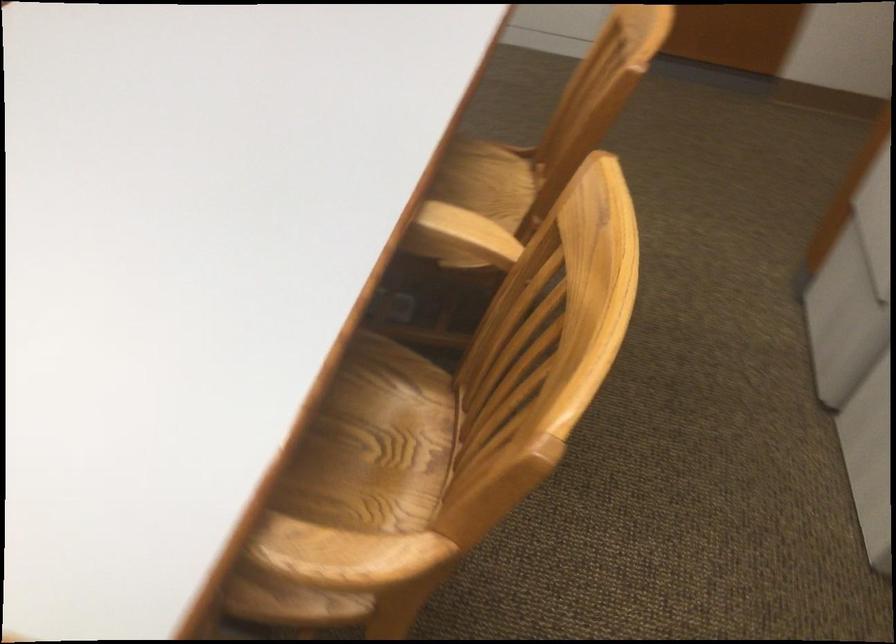
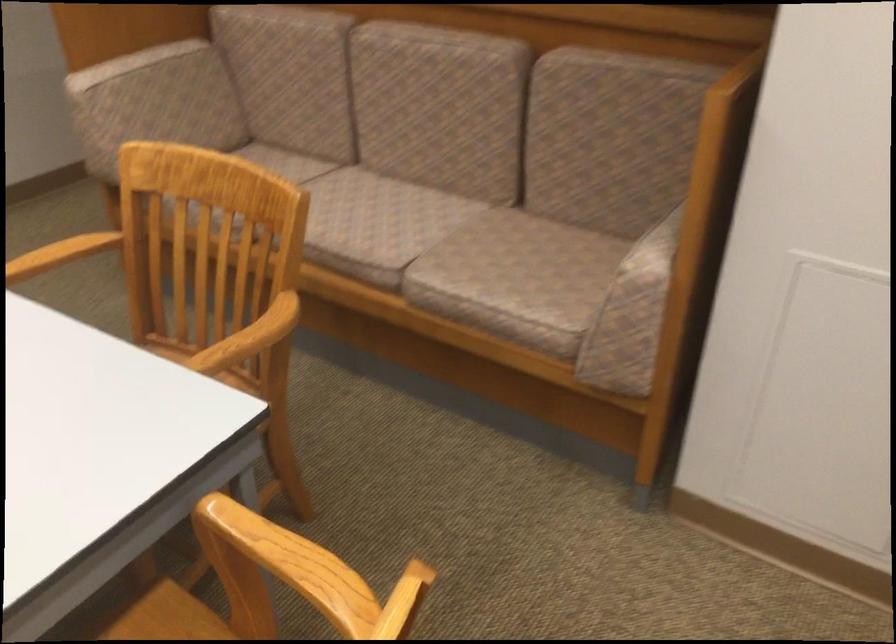
The images are taken continuously from a first-person perspective. In which direction is your viewpoint rotating?

The camera's rotation is toward left-down.